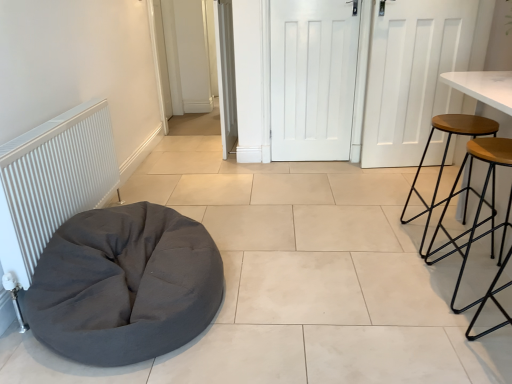
Question: Is white matte door at center, positioned as the second door in right-to-left order, at the right side of wooden seat stool at right, acting as the second stool starting from the back?

Choices:
 (A) yes
 (B) no

Answer: (B)

Question: Does white matte door at center, positioned as the second door in right-to-left order, have a greater height compared to wooden seat stool at right, acting as the second stool starting from the back?

Choices:
 (A) no
 (B) yes

Answer: (B)

Question: Is white matte door at center, positioned as the second door in right-to-left order, directly adjacent to wooden seat stool at right, which is the first stool in front-to-back order?

Choices:
 (A) yes
 (B) no

Answer: (B)

Question: Does white matte door at center, positioned as the second door in right-to-left order, have a smaller size compared to wooden seat stool at right, acting as the second stool starting from the back?

Choices:
 (A) no
 (B) yes

Answer: (B)

Question: From the image's perspective, is white matte door at center, positioned as the 2th door in left-to-right order, below wooden seat stool at right, which is the first stool in front-to-back order?

Choices:
 (A) yes
 (B) no

Answer: (B)

Question: In the image, is wooden seat stool at right, the first stool in the back-to-front sequence, positioned in front of or behind white matte door at center, positioned as the 3th door in right-to-left order?

Choices:
 (A) front
 (B) behind

Answer: (A)

Question: Is point (488, 127) positioned closer to the camera than point (234, 97)?

Choices:
 (A) closer
 (B) farther

Answer: (A)

Question: Considering the positions of wooden seat stool at right, positioned as the second stool in front-to-back order, and white matte door at center, positioned as the 3th door in right-to-left order, in the image, is wooden seat stool at right, positioned as the second stool in front-to-back order, wider or thinner than white matte door at center, positioned as the 3th door in right-to-left order,?

Choices:
 (A) thin
 (B) wide

Answer: (B)

Question: From the image's perspective, relative to white matte door at center, which is the 1th door from left to right, is wooden seat stool at right, the first stool in the back-to-front sequence, above or below?

Choices:
 (A) below
 (B) above

Answer: (A)

Question: Looking at the image, does wooden seat stool at right, acting as the second stool starting from the back, seem bigger or smaller compared to white matte door at center, which is the 1th door from left to right?

Choices:
 (A) small
 (B) big

Answer: (A)

Question: From the image's perspective, is wooden seat stool at right, acting as the second stool starting from the back, located above or below white matte door at center, which is the 1th door from left to right?

Choices:
 (A) above
 (B) below

Answer: (B)

Question: Do you think wooden seat stool at right, acting as the second stool starting from the back, is within white matte door at center, which is the 1th door from left to right, or outside of it?

Choices:
 (A) inside
 (B) outside

Answer: (B)

Question: In terms of height, does wooden seat stool at right, acting as the second stool starting from the back, look taller or shorter compared to white matte door at center, which is the 1th door from left to right?

Choices:
 (A) tall
 (B) short

Answer: (B)

Question: Considering their positions, is dark gray fabric bean bag at lower left located in front of or behind wooden seat stool at right, which is the first stool in front-to-back order?

Choices:
 (A) front
 (B) behind

Answer: (A)

Question: From a real-world perspective, is dark gray fabric bean bag at lower left above or below wooden seat stool at right, which is the first stool in front-to-back order?

Choices:
 (A) above
 (B) below

Answer: (B)